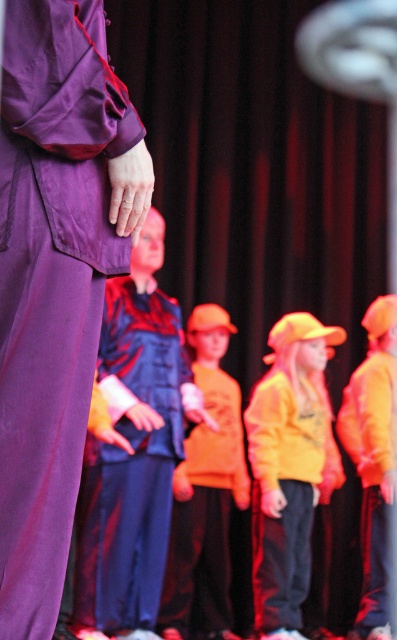
Question: Can you confirm if orange matte shirt at center is wider than orange fleece jacket at right?

Choices:
 (A) no
 (B) yes

Answer: (B)

Question: Is purple matte robe at left positioned at the back of orange fleece jacket at right?

Choices:
 (A) no
 (B) yes

Answer: (A)

Question: Is orange matte shirt at center below orange fleece jacket at right?

Choices:
 (A) yes
 (B) no

Answer: (B)

Question: Which of these objects is positioned closest to the orange fleece jacket at right?

Choices:
 (A) purple matte robe at left
 (B) orange matte shirt at center
 (C) velvet blue robe at center
 (D) matte yellow hoodie at center

Answer: (D)

Question: Among these objects, which one is farthest from the camera?

Choices:
 (A) orange matte shirt at center
 (B) velvet blue robe at center
 (C) purple matte robe at left

Answer: (A)

Question: Which is nearer to the purple matte robe at left?

Choices:
 (A) velvet blue robe at center
 (B) orange fleece jacket at right

Answer: (A)